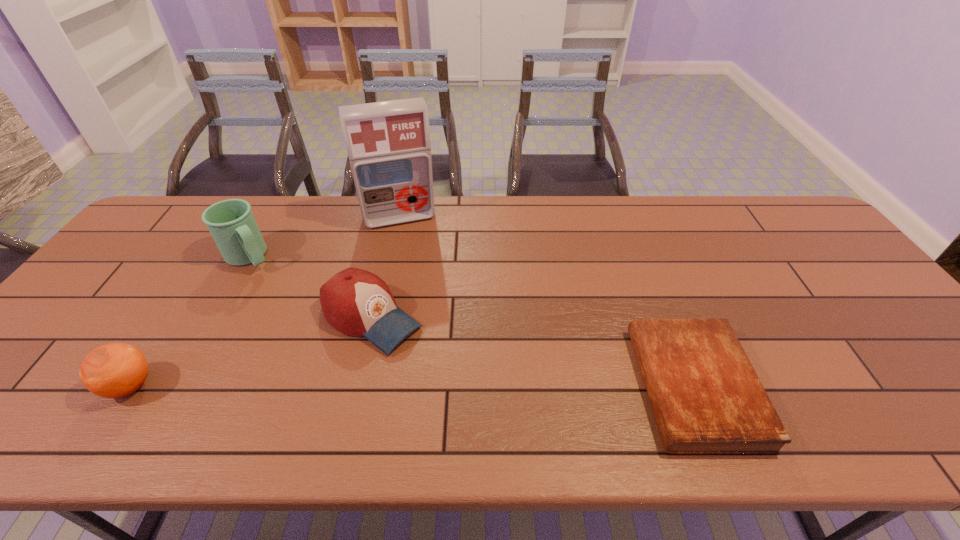
Identify the location of free spot on the desktop that is between the orange and the Bible and is positioned on the side of the mug with the handle. (376, 386).

You are a GUI agent. You are given a task and a screenshot of the screen. Output one action in this format:
    pyautogui.click(x=<x>, y=<y>)
    Task: Click on the free space on the desktop that is between the orange and the shortest object and is positioned on the front-facing side of the baseball cap
    The image size is (960, 540).
    Given the screenshot: What is the action you would take?
    pyautogui.click(x=469, y=386)

Locate an element on the screen. free space on the desktop that is between the orange and the Bible and is positioned on the front-facing side of the tallest object is located at coordinates (444, 386).